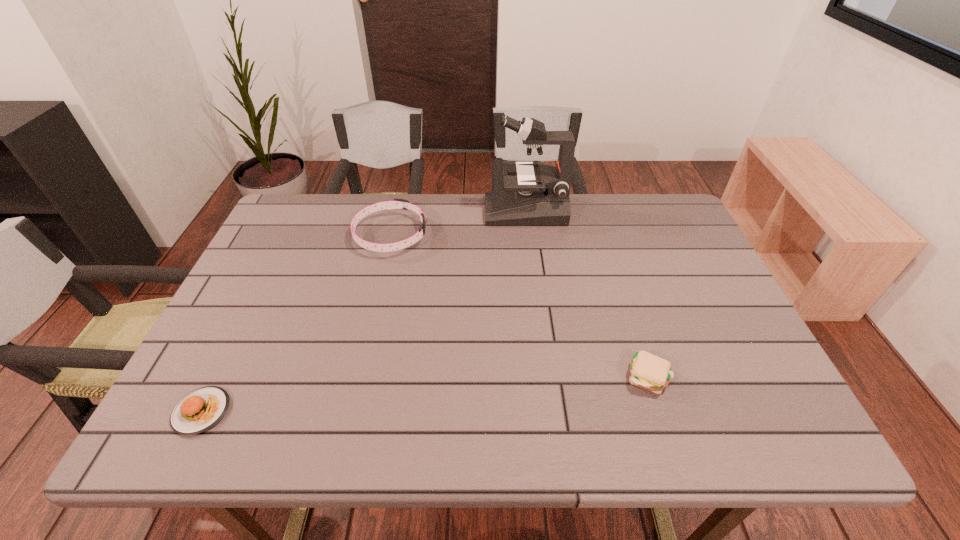
Where is `blank space located 0.130m through the eyepieces of the microscope`? Image resolution: width=960 pixels, height=540 pixels. blank space located 0.130m through the eyepieces of the microscope is located at coordinates (444, 211).

Where is `blank space located with the buckle on the dog collar`? The width and height of the screenshot is (960, 540). blank space located with the buckle on the dog collar is located at coordinates (514, 235).

Identify the location of vacant space positioned 0.320m on the back of the third tallest object. (612, 263).

You are a GUI agent. You are given a task and a screenshot of the screen. Output one action in this format:
    pyautogui.click(x=<x>, y=<y>)
    Task: Click on the vacant space located 0.330m on the right of the leftmost object
    The height and width of the screenshot is (540, 960).
    Given the screenshot: What is the action you would take?
    pyautogui.click(x=391, y=411)

Find the location of `microscope that is positioned at the far edge`. microscope that is positioned at the far edge is located at coordinates (534, 194).

Identify the location of dog collar at the far edge. The width and height of the screenshot is (960, 540). (396, 203).

The width and height of the screenshot is (960, 540). I want to click on object that is at the near edge, so click(x=201, y=409).

This screenshot has height=540, width=960. Find the location of `object located at the left edge`. object located at the left edge is located at coordinates (201, 409).

Locate an element on the screen. Image resolution: width=960 pixels, height=540 pixels. object located at the near left corner is located at coordinates (201, 409).

The width and height of the screenshot is (960, 540). In order to click on vacant space at the far edge in this screenshot , I will do `click(589, 207)`.